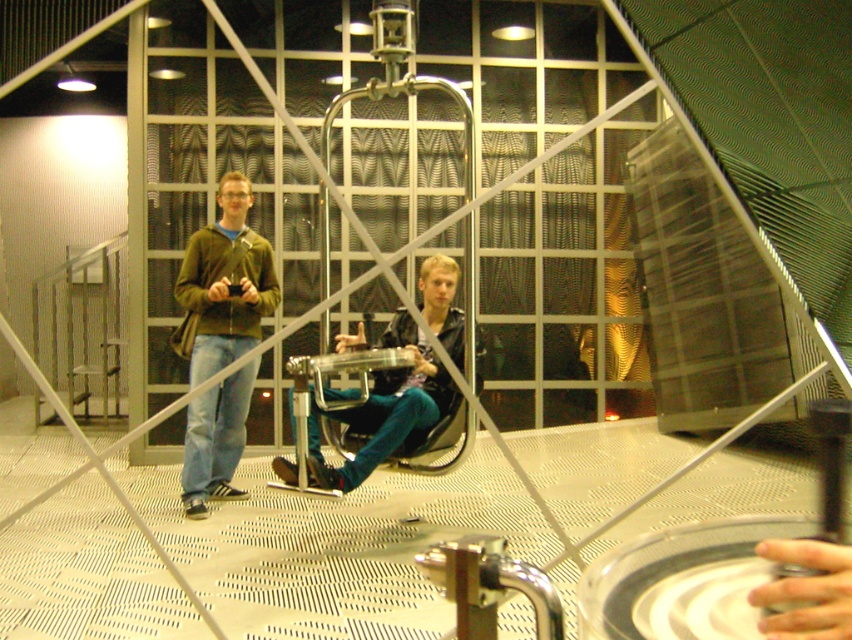
You are an interior designer assessing the placement of clothing items in the scene. The green matte jacket at left and teal denim jeans at center are part of a display. Which clothing item is positioned more to the left side of the scene?

The green matte jacket at left is positioned more to the left side of the scene than the teal denim jeans at center.

You are standing in the industrial room and see the transparent circular platform supported by a central column. There is a point marked at coordinates (223, 285). What object is located at that point?

The point at coordinates (223, 285) corresponds to the green matte jacket at left.

You are an interior designer assessing the placement of items in the room. You notice the green matte jacket at left and the teal denim jeans at center. Which item is closer to you as you stand at the entrance of the room?

The green matte jacket at left is closer to you because it is positioned further to the viewer than the teal denim jeans at center, meaning it appears nearer in the scene.